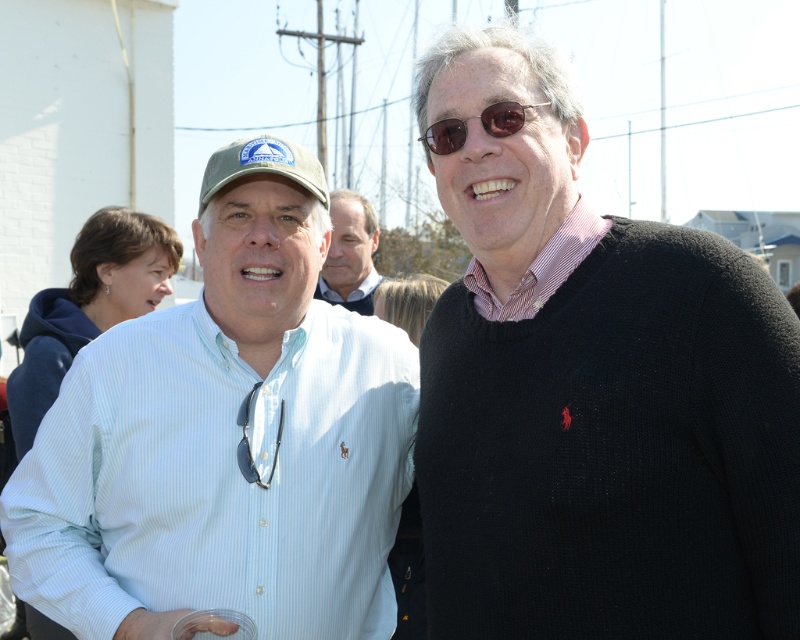
Question: Is light blue striped shirt at left to the left of green fabric baseball cap at upper center from the viewer's perspective?

Choices:
 (A) no
 (B) yes

Answer: (B)

Question: Can you confirm if light blue striped shirt at left is bigger than sunglasses at center?

Choices:
 (A) yes
 (B) no

Answer: (A)

Question: Which object is farther from the camera taking this photo?

Choices:
 (A) light blue striped shirt at left
 (B) matte black goggles at center

Answer: (B)

Question: Which point is farther from the camera taking this photo?

Choices:
 (A) 244,444
 (B) 152,272

Answer: (B)

Question: Which of the following is the farthest from the observer?

Choices:
 (A) (244, 436)
 (B) (276, 161)
 (C) (421, 288)
 (D) (434, 147)

Answer: (C)

Question: Is the position of green fabric baseball cap at upper center more distant than that of blonde hair at upper center?

Choices:
 (A) no
 (B) yes

Answer: (A)